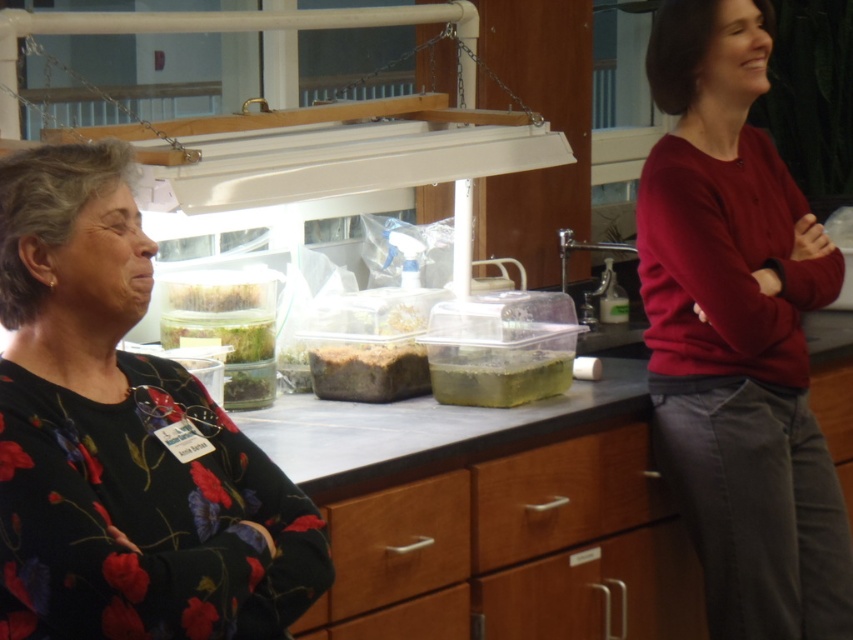
Question: Is matte red sweater at right thinner than brown matte soil at center?

Choices:
 (A) yes
 (B) no

Answer: (B)

Question: Does floral print blouse at center appear on the right side of translucent plastic container at center?

Choices:
 (A) no
 (B) yes

Answer: (A)

Question: Which object appears closest to the camera in this image?

Choices:
 (A) matte red sweater at right
 (B) translucent plastic container at center
 (C) brown matte soil at center
 (D) floral print blouse at center

Answer: (D)

Question: Which point appears farthest from the camera in this image?

Choices:
 (A) (428, 376)
 (B) (251, 547)

Answer: (A)

Question: Based on their relative distances, which object is farther from the brown matte soil at center?

Choices:
 (A) floral print blouse at center
 (B) matte red sweater at right

Answer: (A)

Question: Does matte red sweater at right appear on the right side of brown matte soil at center?

Choices:
 (A) no
 (B) yes

Answer: (B)